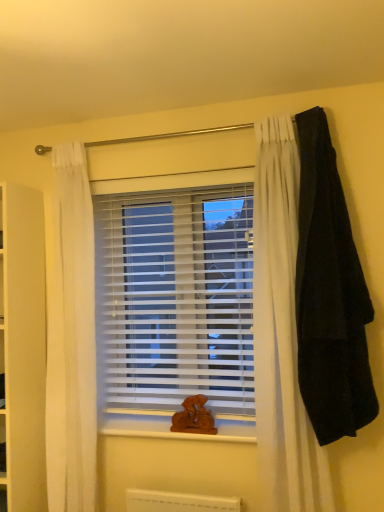
Find the location of a particular element. This screenshot has height=512, width=384. free area below white plastic blinds at center (from a real-world perspective) is located at coordinates (162, 424).